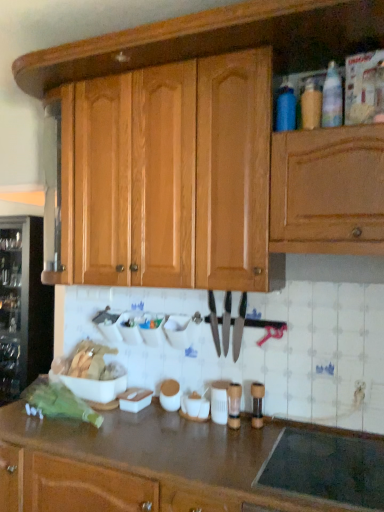
Question: In which direction should I rotate to look at black metallic knife at center, which appears as the first knife when viewed from the right?

Choices:
 (A) left
 (B) right

Answer: (B)

Question: Does shiny silver knife at center have a lesser width compared to blue matte bottle at upper right, the first bottle positioned from the left?

Choices:
 (A) no
 (B) yes

Answer: (B)

Question: Is shiny silver knife at center next to blue matte bottle at upper right, acting as the third bottle starting from the right, and touching it?

Choices:
 (A) no
 (B) yes

Answer: (A)

Question: Considering the relative sizes of shiny silver knife at center and blue matte bottle at upper right, acting as the third bottle starting from the right, in the image provided, is shiny silver knife at center wider than blue matte bottle at upper right, acting as the third bottle starting from the right,?

Choices:
 (A) no
 (B) yes

Answer: (A)

Question: Is shiny silver knife at center at the right side of blue matte bottle at upper right, the first bottle positioned from the left?

Choices:
 (A) no
 (B) yes

Answer: (A)

Question: From a real-world perspective, is shiny silver knife at center over blue matte bottle at upper right, the first bottle positioned from the left?

Choices:
 (A) yes
 (B) no

Answer: (B)

Question: From the image's perspective, is shiny silver knife at center below blue matte bottle at upper right, acting as the third bottle starting from the right?

Choices:
 (A) yes
 (B) no

Answer: (A)

Question: Is translucent plastic bottle at upper right, placed as the first bottle when sorted from right to left, bigger than black glass stovetop at lower right?

Choices:
 (A) no
 (B) yes

Answer: (A)

Question: From the image's perspective, is translucent plastic bottle at upper right, placed as the first bottle when sorted from right to left, above black glass stovetop at lower right?

Choices:
 (A) no
 (B) yes

Answer: (B)

Question: From the image's perspective, is translucent plastic bottle at upper right, placed as the first bottle when sorted from right to left, below black glass stovetop at lower right?

Choices:
 (A) no
 (B) yes

Answer: (A)

Question: Is black glass stovetop at lower right located within translucent plastic bottle at upper right, the 3th bottle in the left-to-right sequence?

Choices:
 (A) yes
 (B) no

Answer: (B)

Question: Can you confirm if translucent plastic bottle at upper right, placed as the first bottle when sorted from right to left, is taller than black glass stovetop at lower right?

Choices:
 (A) yes
 (B) no

Answer: (A)

Question: Does translucent plastic bottle at upper right, placed as the first bottle when sorted from right to left, appear on the left side of black glass stovetop at lower right?

Choices:
 (A) yes
 (B) no

Answer: (B)

Question: From a real-world perspective, is transparent glass wine cooler at left under black glass stovetop at lower right?

Choices:
 (A) no
 (B) yes

Answer: (A)